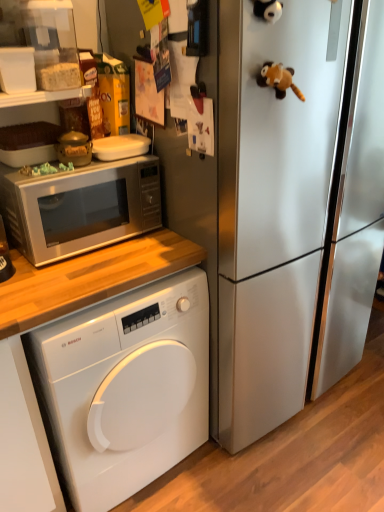
What do you see at coordinates (125, 388) in the screenshot?
I see `white glossy washing machine at lower left` at bounding box center [125, 388].

Where is `brown plush toy at upper right`? This screenshot has height=512, width=384. brown plush toy at upper right is located at coordinates (278, 79).

From the image's perspective, is satin silver refrigerator at center under brown plush toy at upper right?

Yes, from the image's perspective, satin silver refrigerator at center is below brown plush toy at upper right.

Could you tell me if satin silver refrigerator at center is turned towards brown plush toy at upper right?

Yes.

Is satin silver refrigerator at center far away from brown plush toy at upper right?

satin silver refrigerator at center is near brown plush toy at upper right, not far away.

Is white glossy washing machine at lower left completely or partially outside of satin silver refrigerator at center?

Yes, white glossy washing machine at lower left is outside of satin silver refrigerator at center.

Which is in front, point (173, 452) or point (270, 419)?

The point (173, 452) is closer.

Identify the location of washing machine below the satin silver refrigerator at center (from the image's perspective). (125, 388).

Does white glossy washing machine at lower left have a greater width compared to satin silver refrigerator at center?

In fact, white glossy washing machine at lower left might be narrower than satin silver refrigerator at center.

Considering the positions of objects satin silver refrigerator at center and satin silver microwave at upper left in the image provided, who is behind, satin silver refrigerator at center or satin silver microwave at upper left?

satin silver microwave at upper left is behind.

Is satin silver refrigerator at center not close to satin silver microwave at upper left?

No, satin silver refrigerator at center is not far away from satin silver microwave at upper left.

Which is behind, brown plush toy at upper right or white glossy washing machine at lower left?

white glossy washing machine at lower left is further away from the camera.

Between point (281, 76) and point (158, 284), which one is positioned in front?

The point (281, 76) is closer.

Locate an element on the screen. washing machine on the left side of brown plush toy at upper right is located at coordinates (125, 388).

Based on the photo, is white glossy washing machine at lower left wider than brown plush toy at upper right?

Correct, the width of white glossy washing machine at lower left exceeds that of brown plush toy at upper right.

Is white glossy washing machine at lower left aimed at brown plush toy at upper right?

No, white glossy washing machine at lower left is not facing towards brown plush toy at upper right.

Does white glossy washing machine at lower left appear on the left side of brown plush toy at upper right?

Yes, white glossy washing machine at lower left is to the left of brown plush toy at upper right.

Is point (236, 191) positioned before point (94, 333)?

Yes, point (236, 191) is in front of point (94, 333).

Who is taller, satin silver refrigerator at center or white glossy washing machine at lower left?

satin silver refrigerator at center.

Considering the relative positions of satin silver refrigerator at center and white glossy washing machine at lower left in the image provided, is satin silver refrigerator at center to the right of white glossy washing machine at lower left from the viewer's perspective?

Indeed, satin silver refrigerator at center is positioned on the right side of white glossy washing machine at lower left.

Considering the relative sizes of satin silver refrigerator at center and white glossy washing machine at lower left in the image provided, is satin silver refrigerator at center thinner than white glossy washing machine at lower left?

No.

Is brown plush toy at upper right not within satin silver refrigerator at center?

No, brown plush toy at upper right is not outside of satin silver refrigerator at center.

Does brown plush toy at upper right have a greater height compared to satin silver refrigerator at center?

In fact, brown plush toy at upper right may be shorter than satin silver refrigerator at center.

Locate an element on the screen. The image size is (384, 512). toy located above the satin silver refrigerator at center (from a real-world perspective) is located at coordinates (278, 79).

Is brown plush toy at upper right not near satin silver refrigerator at center?

No, brown plush toy at upper right is not far from satin silver refrigerator at center.

You are a GUI agent. You are given a task and a screenshot of the screen. Output one action in this format:
    pyautogui.click(x=<x>, y=<y>)
    Task: Click on the refrigerator on the right of brown plush toy at upper right
    This screenshot has width=384, height=512.
    Given the screenshot: What is the action you would take?
    pyautogui.click(x=282, y=207)

You are a GUI agent. You are given a task and a screenshot of the screen. Output one action in this format:
    pyautogui.click(x=<x>, y=<y>)
    Task: Click on the refrigerator that is above the white glossy washing machine at lower left (from a real-world perspective)
    This screenshot has width=384, height=512.
    Given the screenshot: What is the action you would take?
    pyautogui.click(x=282, y=207)

Based on the photo, when comparing their distances from satin silver microwave at upper left, does satin silver refrigerator at center or white glossy washing machine at lower left seem closer?

Among the two, white glossy washing machine at lower left is located nearer to satin silver microwave at upper left.

Looking at the image, which one is located further to brown plush toy at upper right, satin silver refrigerator at center or satin silver microwave at upper left?

satin silver microwave at upper left.

Based on their spatial positions, is satin silver microwave at upper left or white glossy washing machine at lower left further from brown plush toy at upper right?

Among the two, white glossy washing machine at lower left is located further to brown plush toy at upper right.

Looking at the image, which one is located closer to brown plush toy at upper right, white glossy washing machine at lower left or satin silver refrigerator at center?

satin silver refrigerator at center is positioned closer to the anchor brown plush toy at upper right.

In the scene shown: Which object lies further to the anchor point brown plush toy at upper right, satin silver microwave at upper left or satin silver refrigerator at center?

satin silver microwave at upper left lies further to brown plush toy at upper right than the other object.

Looking at the image, which one is located closer to white glossy washing machine at lower left, satin silver refrigerator at center or brown plush toy at upper right?

Based on the image, satin silver refrigerator at center appears to be nearer to white glossy washing machine at lower left.

Which object lies further to the anchor point satin silver microwave at upper left, brown plush toy at upper right or white glossy washing machine at lower left?

brown plush toy at upper right lies further to satin silver microwave at upper left than the other object.

From the image, which object appears to be nearer to satin silver refrigerator at center, satin silver microwave at upper left or brown plush toy at upper right?

brown plush toy at upper right is positioned closer to the anchor satin silver refrigerator at center.

This screenshot has height=512, width=384. I want to click on refrigerator between brown plush toy at upper right and white glossy washing machine at lower left in the vertical direction, so click(282, 207).

Locate an element on the screen. washing machine between satin silver microwave at upper left and satin silver refrigerator at center in the horizontal direction is located at coordinates (125, 388).

This screenshot has width=384, height=512. In order to click on toy between satin silver microwave at upper left and satin silver refrigerator at center in the horizontal direction in this screenshot , I will do `click(278, 79)`.

Where is `microwave oven between brown plush toy at upper right and white glossy washing machine at lower left from top to bottom`? The width and height of the screenshot is (384, 512). microwave oven between brown plush toy at upper right and white glossy washing machine at lower left from top to bottom is located at coordinates (80, 207).